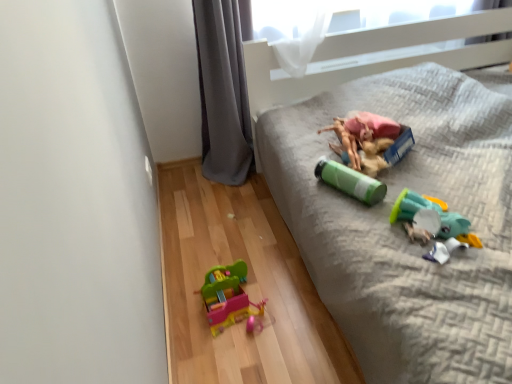
Where is `vacant space underneath multicolored plastic toy at lower center, the 4th toy positioned from the top (from a real-world perspective)`? vacant space underneath multicolored plastic toy at lower center, the 4th toy positioned from the top (from a real-world perspective) is located at coordinates (238, 308).